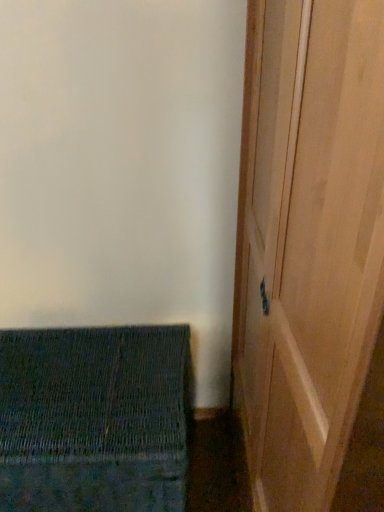
I want to click on textured green step stool at lower left, so click(93, 420).

The image size is (384, 512). What do you see at coordinates (93, 420) in the screenshot?
I see `textured green step stool at lower left` at bounding box center [93, 420].

You are a GUI agent. You are given a task and a screenshot of the screen. Output one action in this format:
    pyautogui.click(x=<x>, y=<y>)
    Task: Click on the textured green step stool at lower left
    This screenshot has width=384, height=512.
    Given the screenshot: What is the action you would take?
    pyautogui.click(x=93, y=420)